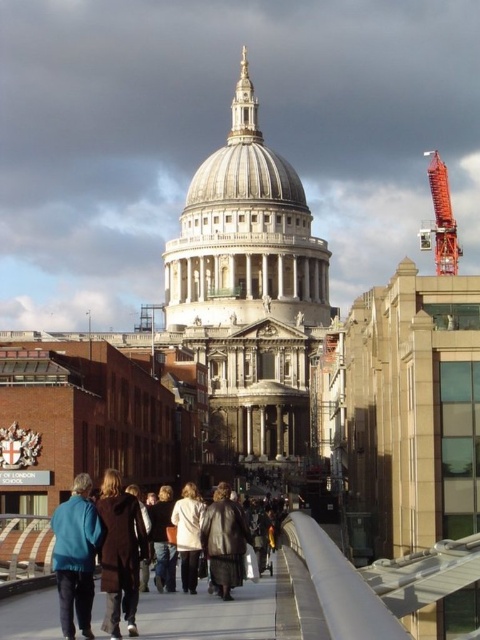
Can you confirm if dark brown leather shoes at lower center is positioned below white matte coat at center?

Yes, dark brown leather shoes at lower center is below white matte coat at center.

Between point (94, 627) and point (188, 536), which one is positioned in front?

Point (94, 627) is in front.

Find the location of `dark brown leather shoes at lower center`. dark brown leather shoes at lower center is located at coordinates [x=210, y=612].

Can you confirm if blue leather jacket at lower left is shorter than leather jacket at center?

Incorrect, blue leather jacket at lower left's height does not fall short of leather jacket at center's.

How distant is blue leather jacket at lower left from leather jacket at center?

A distance of 30.11 feet exists between blue leather jacket at lower left and leather jacket at center.

Who is more distant from viewer, (84, 552) or (225, 554)?

The point (225, 554) is behind.

This screenshot has width=480, height=640. Identify the location of blue leather jacket at lower left. (75, 556).

Does blue leather jacket at lower left appear on the right side of dark blue jeans at center?

No, blue leather jacket at lower left is not to the right of dark blue jeans at center.

Between blue leather jacket at lower left and dark blue jeans at center, which one has more height?

blue leather jacket at lower left

You are a GUI agent. You are given a task and a screenshot of the screen. Output one action in this format:
    pyautogui.click(x=<x>, y=<y>)
    Task: Click on the blue leather jacket at lower left
    The image size is (480, 640).
    Given the screenshot: What is the action you would take?
    pyautogui.click(x=75, y=556)

At what (x,y) coordinates should I click in order to perform the action: click on blue leather jacket at lower left. Please return your answer as a coordinate pair (x, y). The image size is (480, 640). Looking at the image, I should click on (75, 556).